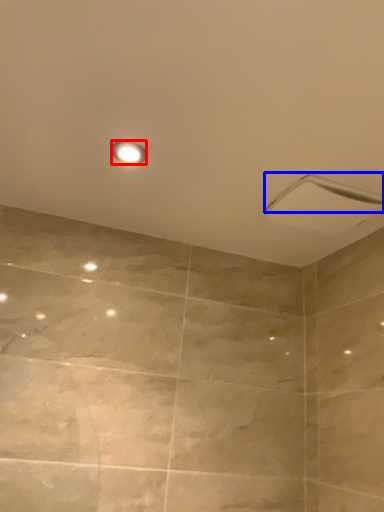
Question: Which of the following is the farthest to the observer, light fixture (highlighted by a red box) or shower (highlighted by a blue box)?

Choices:
 (A) light fixture
 (B) shower

Answer: (B)